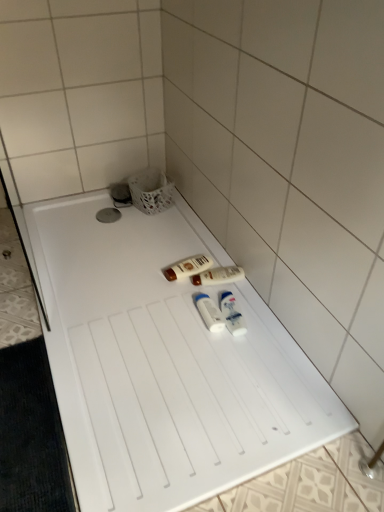
In order to click on free space in front of white plastic tubes at center, placed as the 3th toiletry when sorted from back to front in this screenshot , I will do `click(206, 355)`.